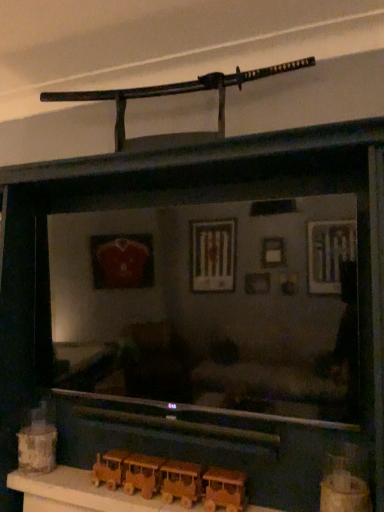
Question: Does wooden train at lower center, which is counted as the 2th toy, starting from the back, have a greater height compared to wooden train set at lower center?

Choices:
 (A) no
 (B) yes

Answer: (B)

Question: Does wooden train at lower center, which is counted as the 2th toy, starting from the back, lie behind wooden train set at lower center?

Choices:
 (A) yes
 (B) no

Answer: (A)

Question: From the image's perspective, is wooden train at lower center, the 2th toy from the left, beneath wooden train set at lower center?

Choices:
 (A) no
 (B) yes

Answer: (A)

Question: Is wooden train at lower center, arranged as the second toy when viewed from the right, touching wooden train set at lower center?

Choices:
 (A) no
 (B) yes

Answer: (B)

Question: Is wooden train at lower center, arranged as the second toy when viewed from the right, facing away from wooden train set at lower center?

Choices:
 (A) yes
 (B) no

Answer: (B)

Question: Does point (334, 490) appear closer or farther from the camera than point (152, 480)?

Choices:
 (A) farther
 (B) closer

Answer: (B)

Question: Is wooden train at lower center, the first toy from the front, taller or shorter than wooden train at lower center, which is counted as the 2th toy, starting from the back?

Choices:
 (A) tall
 (B) short

Answer: (A)

Question: Relative to wooden train at lower center, which is counted as the 2th toy, starting from the back, is wooden train at lower center, which appears as the 3th toy when viewed from the left, in front or behind?

Choices:
 (A) front
 (B) behind

Answer: (A)

Question: Is wooden train at lower center, which appears as the 3th toy when viewed from the left, situated inside wooden train at lower center, the 2th toy from the left, or outside?

Choices:
 (A) outside
 (B) inside

Answer: (A)

Question: Considering the positions of wooden train at lower center, which appears as the 3th toy when viewed from the left, and wooden toy train at lower left, the first toy positioned from the back, in the image, is wooden train at lower center, which appears as the 3th toy when viewed from the left, wider or thinner than wooden toy train at lower left, the first toy positioned from the back,?

Choices:
 (A) wide
 (B) thin

Answer: (B)

Question: From a real-world perspective, is wooden train at lower center, the first toy when ordered from right to left, positioned above or below wooden toy train at lower left, the first toy positioned from the back?

Choices:
 (A) below
 (B) above

Answer: (A)

Question: Is point (370, 507) closer or farther from the camera than point (46, 430)?

Choices:
 (A) closer
 (B) farther

Answer: (A)

Question: Is wooden train at lower center, which appears as the 3th toy when viewed from the left, inside the boundaries of wooden toy train at lower left, the first toy positioned from the back, or outside?

Choices:
 (A) inside
 (B) outside

Answer: (B)

Question: Looking at the image, does wooden train at lower center, arranged as the second toy when viewed from the right, seem bigger or smaller compared to wooden train set at lower center?

Choices:
 (A) big
 (B) small

Answer: (B)

Question: Based on their positions, is wooden train at lower center, the 2th toy from the left, located to the left or right of wooden train set at lower center?

Choices:
 (A) left
 (B) right

Answer: (B)